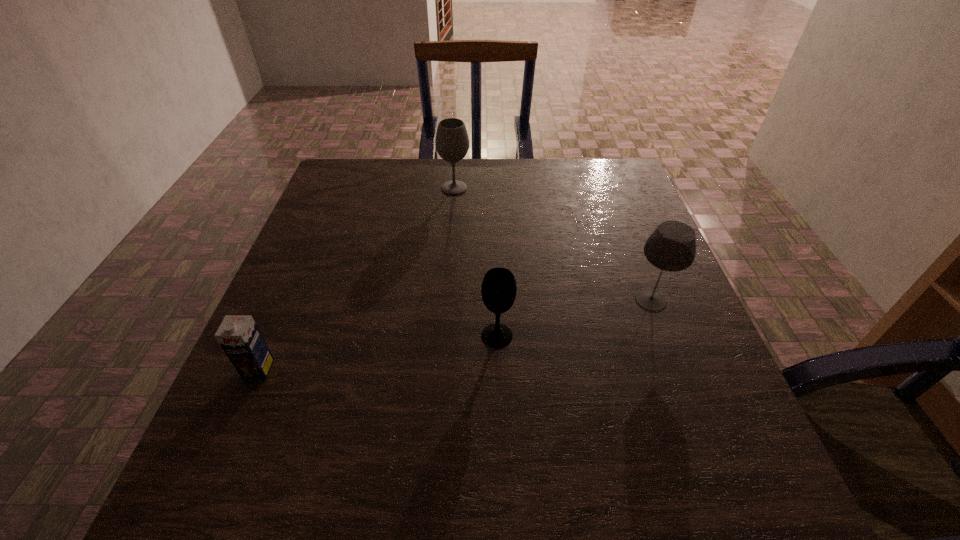
Locate an element on the screen. This screenshot has width=960, height=540. unoccupied area between the farthest wineglass and the leftmost object is located at coordinates (356, 279).

Locate an element on the screen. This screenshot has height=540, width=960. free area in between the second object from right to left and the rightmost object is located at coordinates (574, 318).

Image resolution: width=960 pixels, height=540 pixels. In order to click on vacant area that lies between the rightmost wineglass and the nearest wineglass in this screenshot , I will do coord(574,318).

Where is `free space between the nearest object and the second object from left to right`? The width and height of the screenshot is (960, 540). free space between the nearest object and the second object from left to right is located at coordinates (356, 279).

This screenshot has height=540, width=960. Find the location of `empty space between the leftmost wineglass and the nearest wineglass`. empty space between the leftmost wineglass and the nearest wineglass is located at coordinates (476, 262).

You are a GUI agent. You are given a task and a screenshot of the screen. Output one action in this format:
    pyautogui.click(x=<x>, y=<y>)
    Task: Click on the free space between the rightmost object and the second wineglass from right to left
    The image size is (960, 540).
    Given the screenshot: What is the action you would take?
    pos(574,318)

Where is `vacant area that lies between the rightmost wineglass and the chocolate milk`? Image resolution: width=960 pixels, height=540 pixels. vacant area that lies between the rightmost wineglass and the chocolate milk is located at coordinates click(x=455, y=335).

You are a GUI agent. You are given a task and a screenshot of the screen. Output one action in this format:
    pyautogui.click(x=<x>, y=<y>)
    Task: Click on the free area in between the rightmost object and the shortest object
    The width and height of the screenshot is (960, 540).
    Given the screenshot: What is the action you would take?
    pyautogui.click(x=455, y=335)

The image size is (960, 540). Find the location of `vacant region between the rightmost object and the leftmost object`. vacant region between the rightmost object and the leftmost object is located at coordinates (455, 335).

The width and height of the screenshot is (960, 540). I want to click on vacant area between the second wineglass from right to left and the farthest wineglass, so click(476, 262).